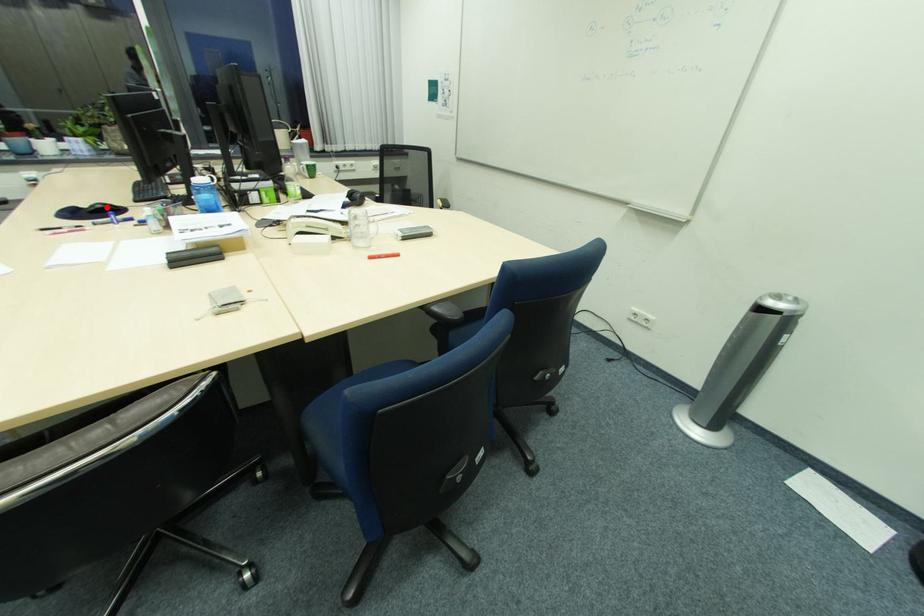
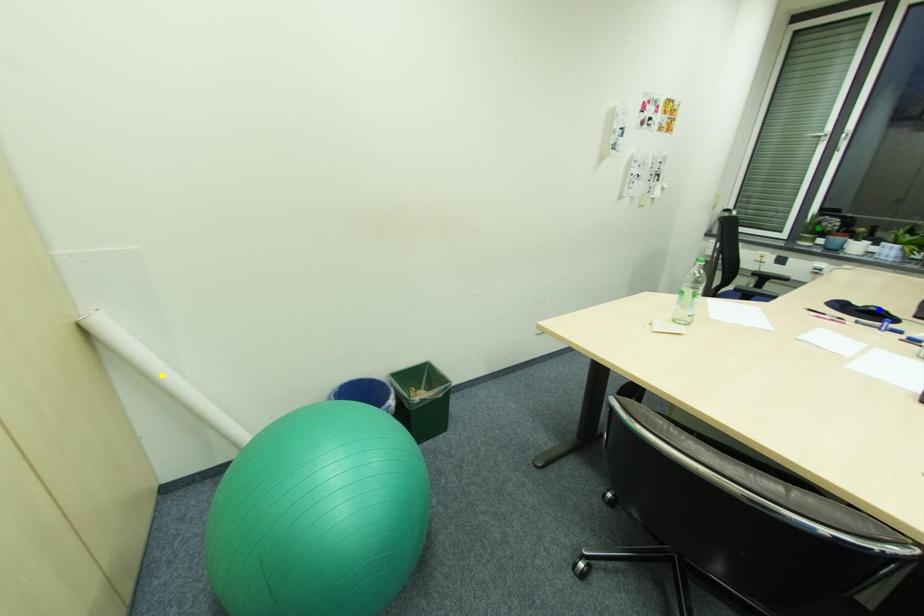
Question: I am providing you with two images of the same scene from different viewpoints. A red point is marked on the first image. You are given multiple points on the second image. Which point in image 2 represents the same 3d spot as the red point in image 1?

Choices:
 (A) blue point
 (B) green point
 (C) yellow point

Answer: (A)